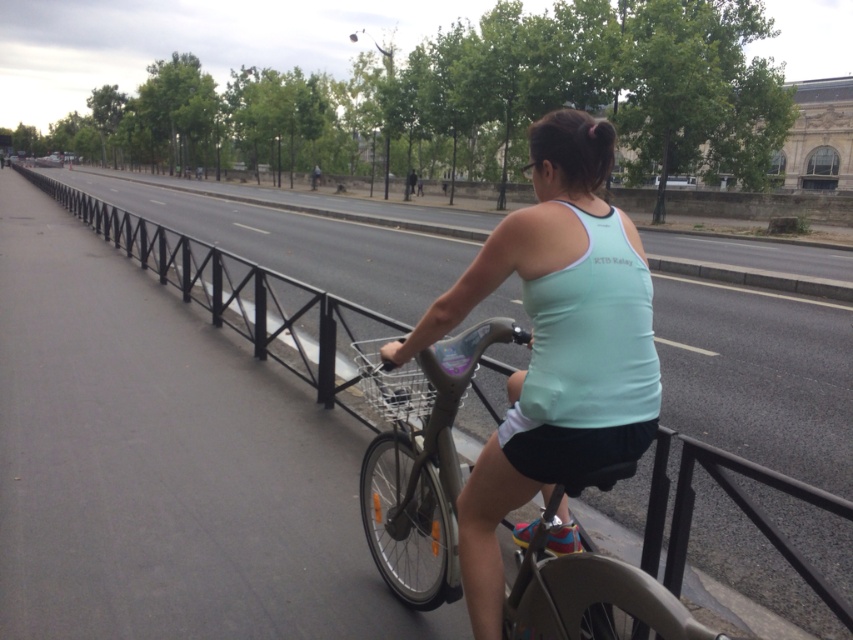
Based on the photo, you are a photographer trying to capture the cyclist wearing the light blue fabric tank top at center. Based on the coordinates provided, where should you position your camera to ensure the tank top is centered in the frame?

The light blue fabric tank top at center is located at point coordinates (554, 346), so you should position your camera to center the frame at those coordinates to capture the tank top at the center of the image.

You are a photographer trying to capture the cyclist in the image. Since the light blue fabric tank top at center and the black metal rail at center are both in the frame, which object should you focus on to ensure the cyclist is clearly visible?

The light blue fabric tank top at center has a smaller size compared to the black metal rail at center. To ensure the cyclist is clearly visible, focus on the light blue fabric tank top at center since it is smaller and likely closer to the camera, making it a better point of focus for the cyclist.